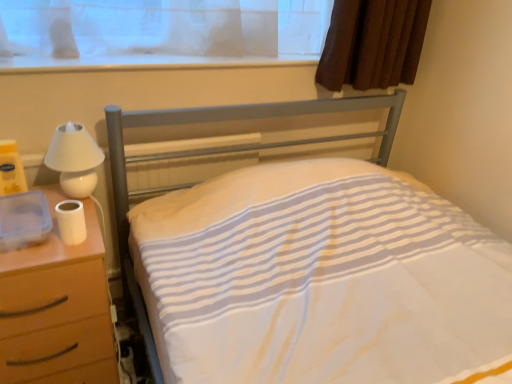
Locate an element on the screen. The image size is (512, 384). vacant area that is in front of white matte toilet paper at left is located at coordinates (50, 257).